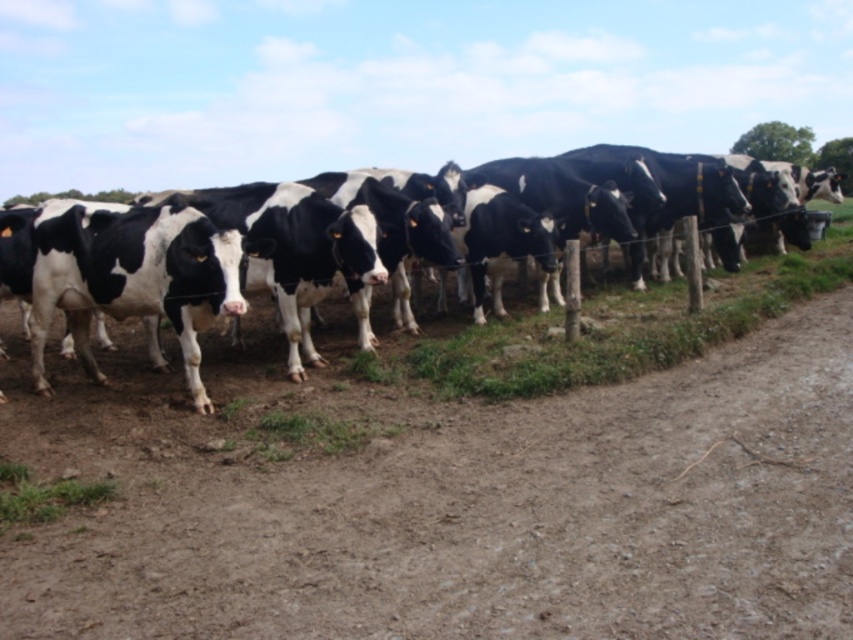
You are a farmer checking the field. You notice the brown sandy dirt at lower center and the black and white cow at center. Which one is wider in terms of their visible area in the image?

The brown sandy dirt at lower center is wider than the black and white cow at center.

You are standing in front of the fence and want to determine which of the two points, point (215,554) or point (630,374), is nearer to you. Based on the image, which point is closer?

Point (215,554) is closer to the camera than point (630,374), so it is the nearer one.